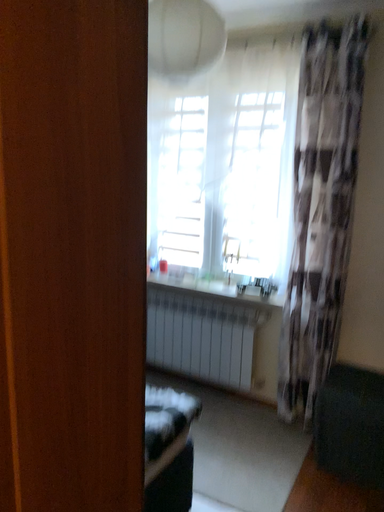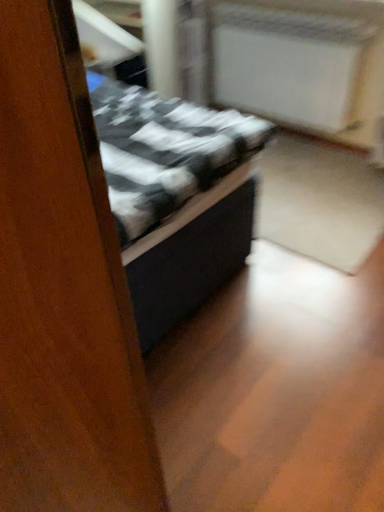
Question: Which way did the camera rotate in the video?

Choices:
 (A) rotated right
 (B) rotated left

Answer: (B)